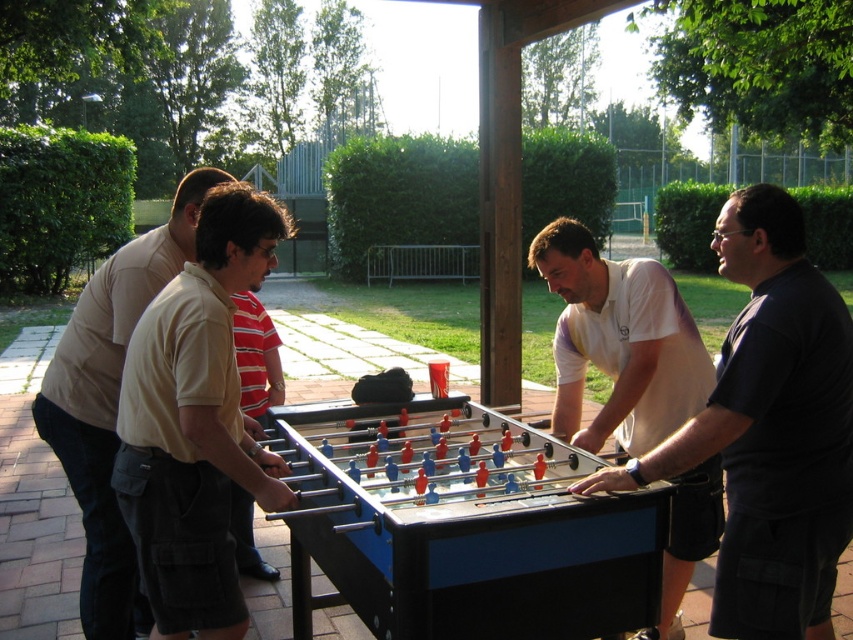
Question: Is the position of dark blue shirt at right less distant than that of beige cotton shirt at left?

Choices:
 (A) yes
 (B) no

Answer: (A)

Question: Among these points, which one is farthest from the camera?

Choices:
 (A) (747, 515)
 (B) (113, 301)

Answer: (B)

Question: From the image, what is the correct spatial relationship of dark blue shirt at right in relation to white matte shirt at center?

Choices:
 (A) right
 (B) left

Answer: (A)

Question: Does white matte shirt at center have a greater width compared to beige cotton shirt at left?

Choices:
 (A) yes
 (B) no

Answer: (B)

Question: Among these points, which one is farthest from the camera?

Choices:
 (A) (56, 362)
 (B) (602, 323)

Answer: (B)

Question: Which of these objects is positioned farthest from the dark blue shirt at right?

Choices:
 (A) beige cotton shirt at left
 (B) white matte shirt at center

Answer: (A)